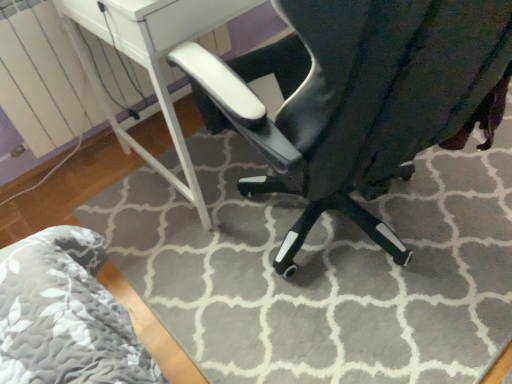
What is the approximate height of white glossy table at center?

The height of white glossy table at center is 31.30 inches.

Locate an element on the screen. The width and height of the screenshot is (512, 384). white glossy table at center is located at coordinates (150, 59).

The image size is (512, 384). What do you see at coordinates (150, 59) in the screenshot?
I see `white glossy table at center` at bounding box center [150, 59].

Describe the element at coordinates (358, 99) in the screenshot. I see `glossy black chair at center` at that location.

You are a GUI agent. You are given a task and a screenshot of the screen. Output one action in this format:
    pyautogui.click(x=<x>, y=<y>)
    Task: Click on the glossy black chair at center
    The image size is (512, 384).
    Given the screenshot: What is the action you would take?
    [358, 99]

This screenshot has width=512, height=384. I want to click on white glossy table at center, so click(150, 59).

Which object is positioned more to the left, white glossy table at center or glossy black chair at center?

From the viewer's perspective, white glossy table at center appears more on the left side.

Between white glossy table at center and glossy black chair at center, which one is positioned behind?

white glossy table at center is behind.

Is point (176, 116) behind point (362, 18)?

Yes, point (176, 116) is farther from viewer.

From the image's perspective, which object appears higher, white glossy table at center or glossy black chair at center?

white glossy table at center, from the image's perspective.

From a real-world perspective, which object rests below the other?

In real-world perspective, white glossy table at center is lower.

Consider the image. Does white glossy table at center have a greater width compared to glossy black chair at center?

Incorrect, the width of white glossy table at center does not surpass that of glossy black chair at center.

Which of these two, white glossy table at center or glossy black chair at center, stands taller?

glossy black chair at center.

Between white glossy table at center and glossy black chair at center, which one has smaller size?

With smaller size is white glossy table at center.

Do you think white glossy table at center is within glossy black chair at center, or outside of it?

white glossy table at center is not inside glossy black chair at center, it's outside.

Are white glossy table at center and glossy black chair at center located far from each other?

No, white glossy table at center is in close proximity to glossy black chair at center.

Could you tell me if white glossy table at center is facing glossy black chair at center?

Yes, white glossy table at center is facing glossy black chair at center.

The image size is (512, 384). What are the coordinates of `chair in front of the white glossy table at center` in the screenshot? It's located at (358, 99).

Considering the positions of objects glossy black chair at center and white glossy table at center in the image provided, who is more to the right, glossy black chair at center or white glossy table at center?

glossy black chair at center is more to the right.

Is glossy black chair at center further to camera compared to white glossy table at center?

No, glossy black chair at center is in front of white glossy table at center.

Considering the positions of point (271, 61) and point (195, 205), is point (271, 61) closer or farther from the camera than point (195, 205)?

Point (271, 61) is positioned farther from the camera compared to point (195, 205).

From the picture: From the image's perspective, which one is positioned higher, glossy black chair at center or white glossy table at center?

white glossy table at center, from the image's perspective.

From a real-world perspective, is glossy black chair at center positioned under white glossy table at center based on gravity?

No.

Is glossy black chair at center wider or thinner than white glossy table at center?

Clearly, glossy black chair at center has more width compared to white glossy table at center.

In terms of height, does glossy black chair at center look taller or shorter compared to white glossy table at center?

In the image, glossy black chair at center appears to be taller than white glossy table at center.

Consider the image. Can you confirm if glossy black chair at center is bigger than white glossy table at center?

Indeed, glossy black chair at center has a larger size compared to white glossy table at center.

Would you say glossy black chair at center is inside or outside white glossy table at center?

glossy black chair at center is not enclosed by white glossy table at center.

Would you consider glossy black chair at center to be distant from white glossy table at center?

glossy black chair at center is near white glossy table at center, not far away.

Is glossy black chair at center turned away from white glossy table at center?

No, glossy black chair at center's orientation is not away from white glossy table at center.

From the picture: How different are the orientations of glossy black chair at center and white glossy table at center in degrees?

glossy black chair at center and white glossy table at center are facing 164 degrees away from each other.

You are a GUI agent. You are given a task and a screenshot of the screen. Output one action in this format:
    pyautogui.click(x=<x>, y=<y>)
    Task: Click on the table that appears on the left of glossy black chair at center
    The width and height of the screenshot is (512, 384).
    Given the screenshot: What is the action you would take?
    pyautogui.click(x=150, y=59)

This screenshot has height=384, width=512. What are the coordinates of `table below the glossy black chair at center (from a real-world perspective)` in the screenshot? It's located at (150, 59).

Where is `table above the glossy black chair at center (from the image's perspective)`? The image size is (512, 384). table above the glossy black chair at center (from the image's perspective) is located at coordinates (150, 59).